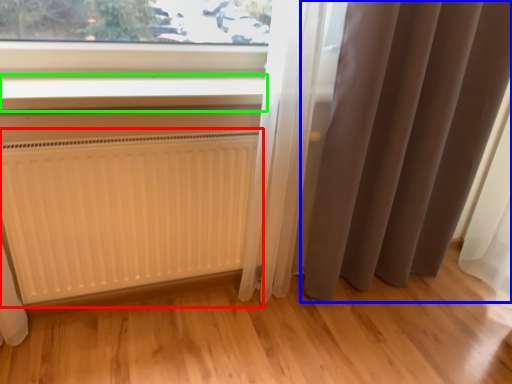
Question: Based on their relative distances, which object is nearer to radiator (highlighted by a red box)? Choose from curtain (highlighted by a blue box) and window sill (highlighted by a green box).

Choices:
 (A) curtain
 (B) window sill

Answer: (B)